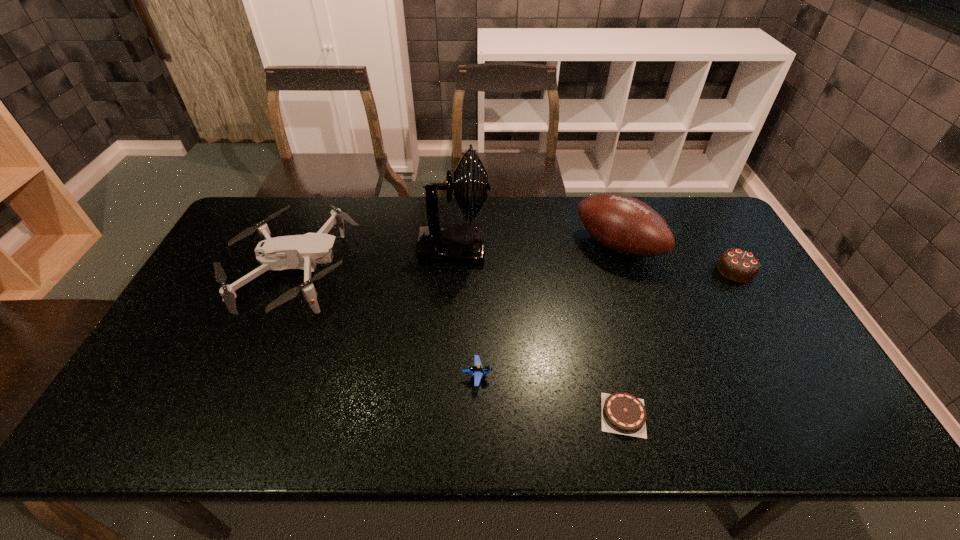
The image size is (960, 540). Find the location of `object that is at the left edge`. object that is at the left edge is located at coordinates (303, 252).

Find the location of a particular element. This screenshot has width=960, height=540. object that is at the right edge is located at coordinates (739, 265).

Identify the location of object at the far left corner. The height and width of the screenshot is (540, 960). (303, 252).

In the image, there is a desktop. Identify the location of vacant space at the far edge. (288, 231).

At what (x,y) coordinates should I click in order to perform the action: click on free spot at the near edge of the desktop. Please return your answer as a coordinate pair (x, y). Looking at the image, I should click on (488, 435).

The height and width of the screenshot is (540, 960). I want to click on free location at the left edge, so click(164, 374).

At what (x,y) coordinates should I click in order to perform the action: click on vacant region at the far right corner of the desktop. Please return your answer as a coordinate pair (x, y). Image resolution: width=960 pixels, height=540 pixels. Looking at the image, I should click on (715, 238).

Identify the location of vacant point located between the third tallest object and the fan. (374, 260).

Identify the location of free point between the football (American) and the shorter chocolate cake. This screenshot has width=960, height=540. (620, 330).

Identify the location of vacant region between the football (American) and the tallest object. This screenshot has height=540, width=960. (536, 246).